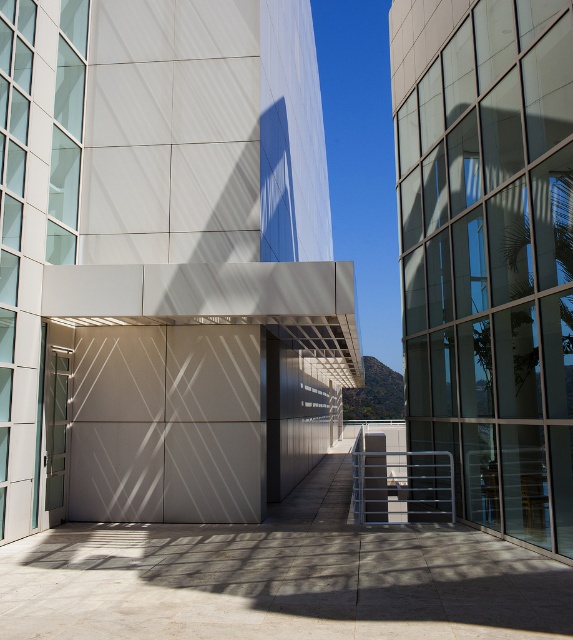
In the scene shown: Which is more to the left, black metal balustrade at lower center or translucent glass door at center?

From the viewer's perspective, translucent glass door at center appears more on the left side.

Does black metal balustrade at lower center have a greater height compared to translucent glass door at center?

Yes, black metal balustrade at lower center is taller than translucent glass door at center.

Which is in front, point (360, 460) or point (58, 516)?

Point (58, 516) is more forward.

You are a GUI agent. You are given a task and a screenshot of the screen. Output one action in this format:
    pyautogui.click(x=<x>, y=<y>)
    Task: Click on the black metal balustrade at lower center
    Image resolution: width=573 pixels, height=640 pixels.
    Given the screenshot: What is the action you would take?
    pyautogui.click(x=402, y=486)